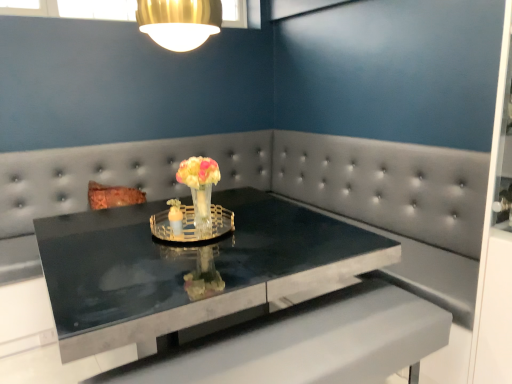
Question: Does translucent glass candle holder at center, which is the 1th candle holder from left to right, have a larger size compared to black marble table at center?

Choices:
 (A) no
 (B) yes

Answer: (A)

Question: Is translucent glass candle holder at center, which is the 1th candle holder from left to right, smaller than black marble table at center?

Choices:
 (A) yes
 (B) no

Answer: (A)

Question: Is black marble table at center at the back of translucent glass candle holder at center, the second candle holder when ordered from right to left?

Choices:
 (A) no
 (B) yes

Answer: (A)

Question: Can you confirm if translucent glass candle holder at center, which is the 1th candle holder from left to right, is positioned to the left of black marble table at center?

Choices:
 (A) yes
 (B) no

Answer: (A)

Question: From the image's perspective, does translucent glass candle holder at center, which is the 1th candle holder from left to right, appear lower than black marble table at center?

Choices:
 (A) yes
 (B) no

Answer: (B)

Question: Is black marble table at center inside translucent glass candle holder at center, the second candle holder when ordered from right to left?

Choices:
 (A) no
 (B) yes

Answer: (A)

Question: Does clear glass candle holder at center, placed as the 1th candle holder when sorted from right to left, have a greater width compared to translucent glass candle holder at center, the second candle holder when ordered from right to left?

Choices:
 (A) no
 (B) yes

Answer: (B)

Question: Can you confirm if clear glass candle holder at center, acting as the second candle holder starting from the left, is positioned to the right of translucent glass candle holder at center, which is the 1th candle holder from left to right?

Choices:
 (A) no
 (B) yes

Answer: (B)

Question: Is the depth of clear glass candle holder at center, acting as the second candle holder starting from the left, greater than that of translucent glass candle holder at center, the second candle holder when ordered from right to left?

Choices:
 (A) no
 (B) yes

Answer: (A)

Question: Considering the relative sizes of clear glass candle holder at center, acting as the second candle holder starting from the left, and translucent glass candle holder at center, which is the 1th candle holder from left to right, in the image provided, is clear glass candle holder at center, acting as the second candle holder starting from the left, smaller than translucent glass candle holder at center, which is the 1th candle holder from left to right,?

Choices:
 (A) yes
 (B) no

Answer: (B)

Question: Is clear glass candle holder at center, placed as the 1th candle holder when sorted from right to left, far away from translucent glass candle holder at center, which is the 1th candle holder from left to right?

Choices:
 (A) yes
 (B) no

Answer: (B)

Question: From the image's perspective, would you say clear glass candle holder at center, acting as the second candle holder starting from the left, is positioned over translucent glass candle holder at center, which is the 1th candle holder from left to right?

Choices:
 (A) no
 (B) yes

Answer: (A)

Question: Considering the relative sizes of clear glass candle holder at center, acting as the second candle holder starting from the left, and translucent glass vase at center in the image provided, is clear glass candle holder at center, acting as the second candle holder starting from the left, wider than translucent glass vase at center?

Choices:
 (A) yes
 (B) no

Answer: (A)